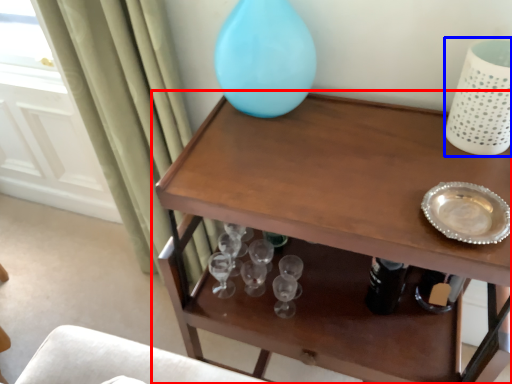
Question: Which object is closer to the camera taking this photo, table (highlighted by a red box) or vase (highlighted by a blue box)?

Choices:
 (A) table
 (B) vase

Answer: (A)